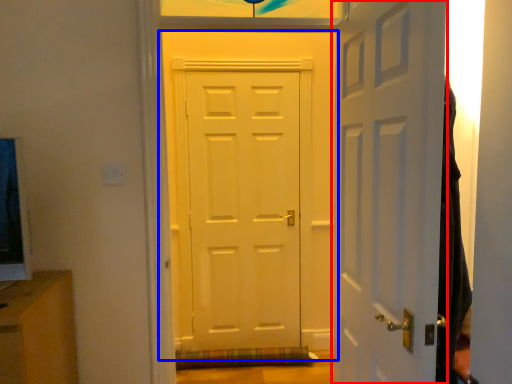
Question: Among these objects, which one is farthest to the camera, door (highlighted by a red box) or door (highlighted by a blue box)?

Choices:
 (A) door
 (B) door

Answer: (B)